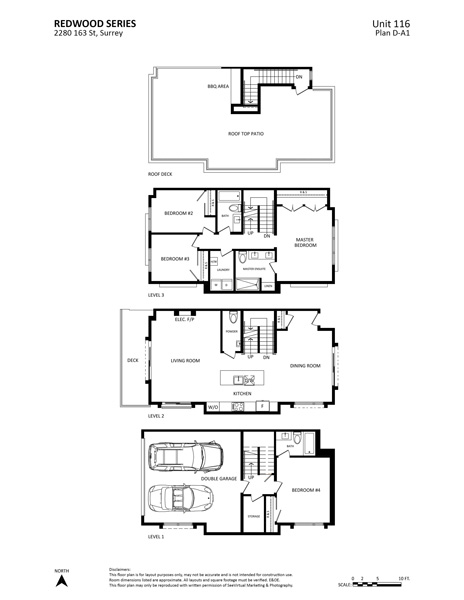
Identify the location of sinks. (x=286, y=435), (x=239, y=379), (x=254, y=253), (x=271, y=255), (x=237, y=218), (x=237, y=343).